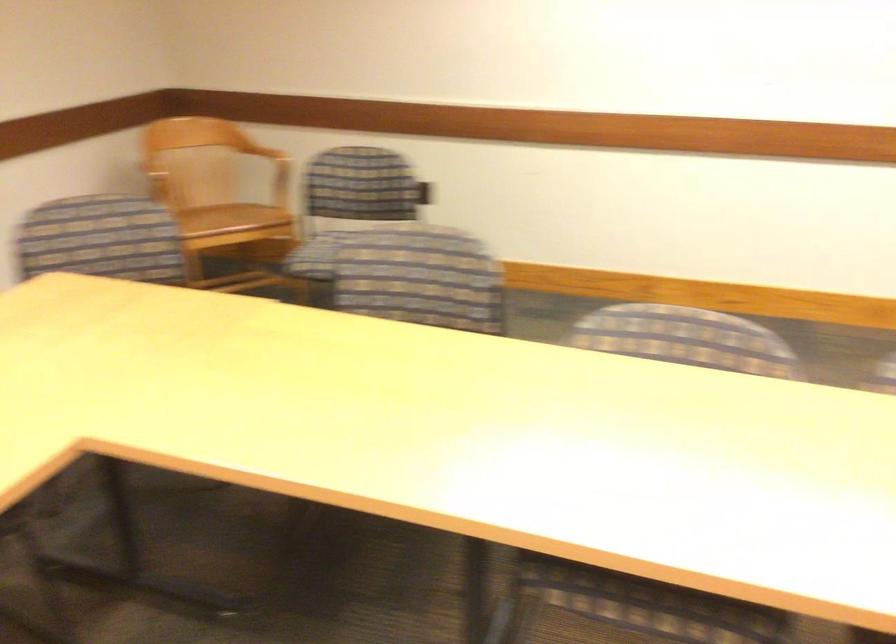
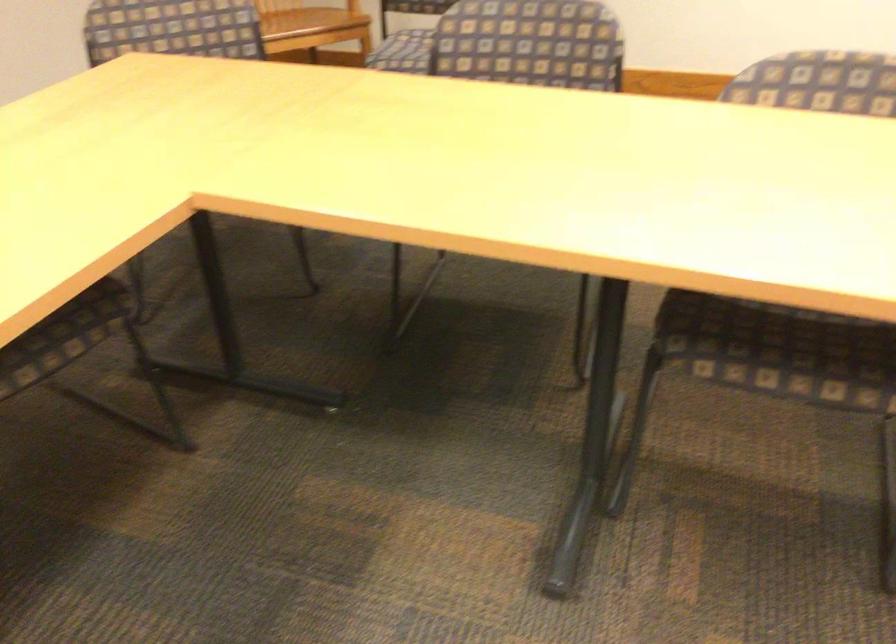
Question: The images are taken continuously from a first-person perspective. In which direction are you moving?

Choices:
 (A) Left
 (B) Right
 (C) Forward
 (D) Backward

Answer: (C)